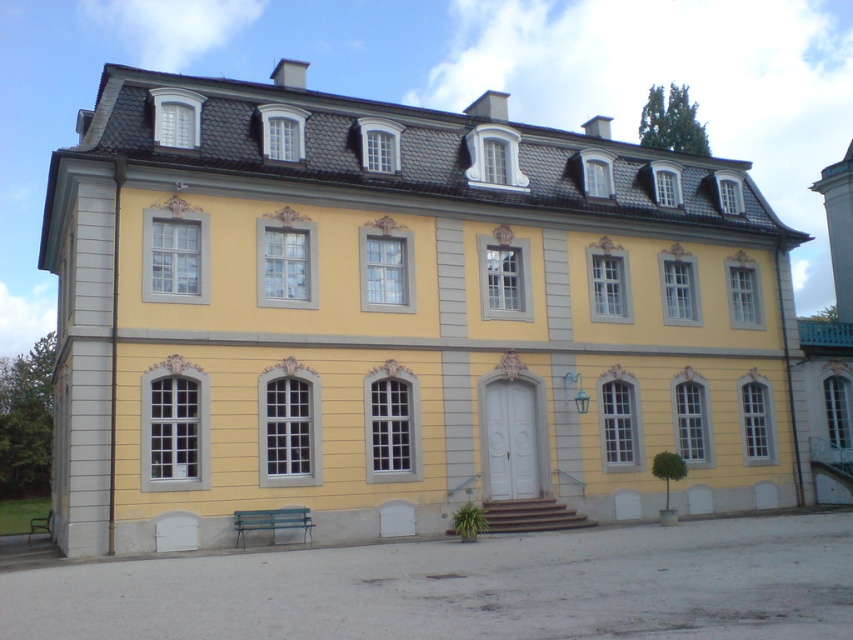
Question: Considering the relative positions of green painted wood bench at lower left and green wooden bench at lower left in the image provided, where is green painted wood bench at lower left located with respect to green wooden bench at lower left?

Choices:
 (A) right
 (B) left

Answer: (A)

Question: Among these objects, which one is nearest to the camera?

Choices:
 (A) green wooden bench at lower left
 (B) green painted wood bench at lower left

Answer: (B)

Question: Considering the relative positions of green painted wood bench at lower left and green wooden bench at lower left in the image provided, where is green painted wood bench at lower left located with respect to green wooden bench at lower left?

Choices:
 (A) below
 (B) above

Answer: (B)

Question: Is green painted wood bench at lower left positioned before green wooden bench at lower left?

Choices:
 (A) no
 (B) yes

Answer: (B)